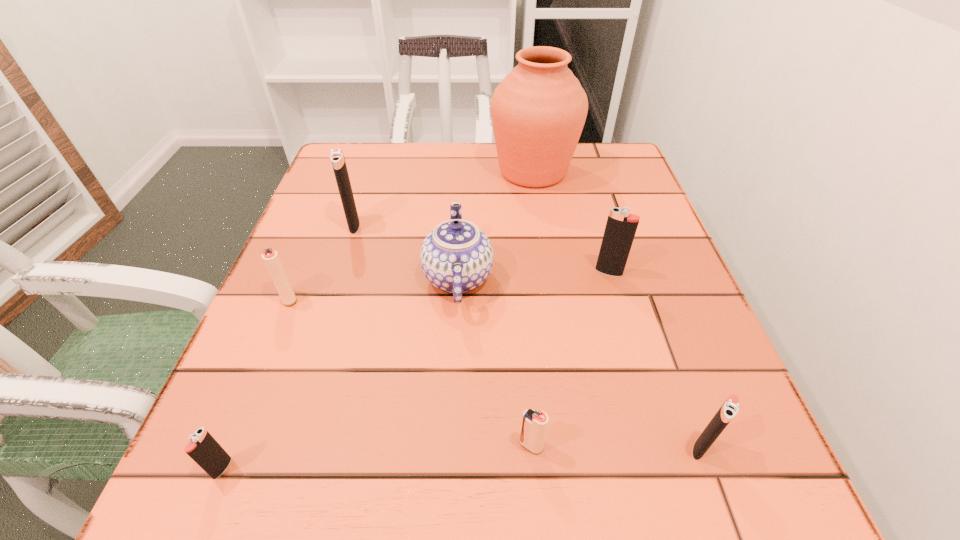
Locate an element on the screen. Image resolution: width=960 pixels, height=540 pixels. vacant space located 0.180m on the right of the third farthest igniter is located at coordinates [397, 298].

I want to click on vacant space located 0.290m on the left of the nearer red igniter, so click(309, 445).

You are a GUI agent. You are given a task and a screenshot of the screen. Output one action in this format:
    pyautogui.click(x=<x>, y=<y>)
    Task: Click on the free space located on the back of the smallest black igniter
    Image resolution: width=960 pixels, height=540 pixels.
    Given the screenshot: What is the action you would take?
    pyautogui.click(x=307, y=261)

Where is `object located in the far edge section of the desktop`? object located in the far edge section of the desktop is located at coordinates (538, 111).

The height and width of the screenshot is (540, 960). Find the location of `urn located at the right edge`. urn located at the right edge is located at coordinates (538, 111).

The height and width of the screenshot is (540, 960). I want to click on object at the near left corner, so click(203, 448).

Locate an element on the screen. The width and height of the screenshot is (960, 540). object that is at the far right corner is located at coordinates (538, 111).

What are the coordinates of `object that is at the near right corner` in the screenshot? It's located at click(x=729, y=409).

This screenshot has width=960, height=540. Identify the location of free space at the far edge of the desktop. (562, 186).

This screenshot has height=540, width=960. What are the coordinates of `vacant space at the near edge of the desktop` in the screenshot? It's located at (304, 505).